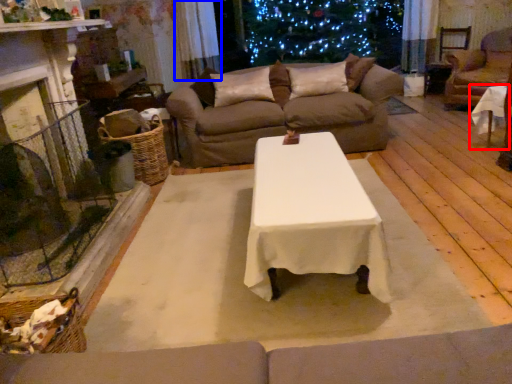
Question: Among these objects, which one is farthest to the camera, table (highlighted by a red box) or curtain (highlighted by a blue box)?

Choices:
 (A) table
 (B) curtain

Answer: (B)